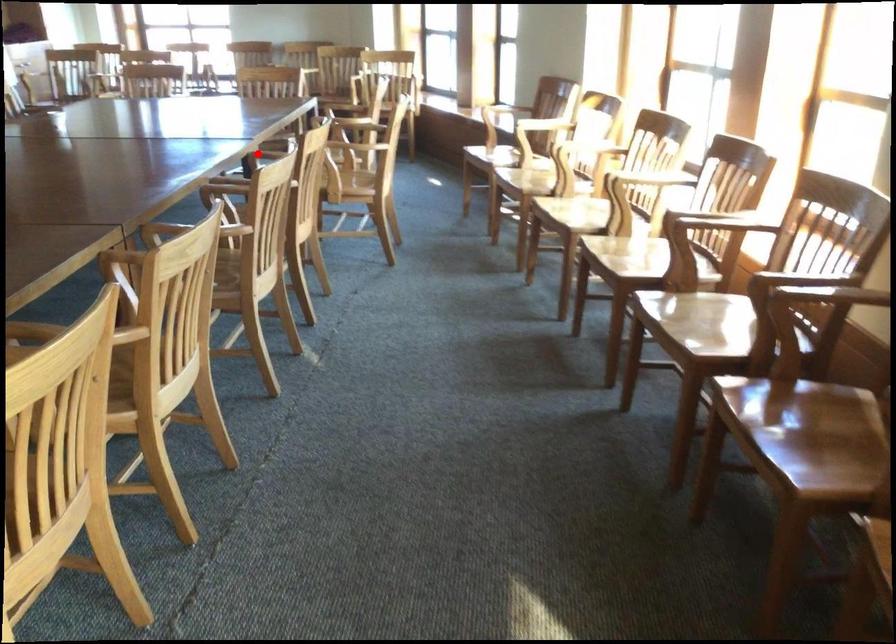
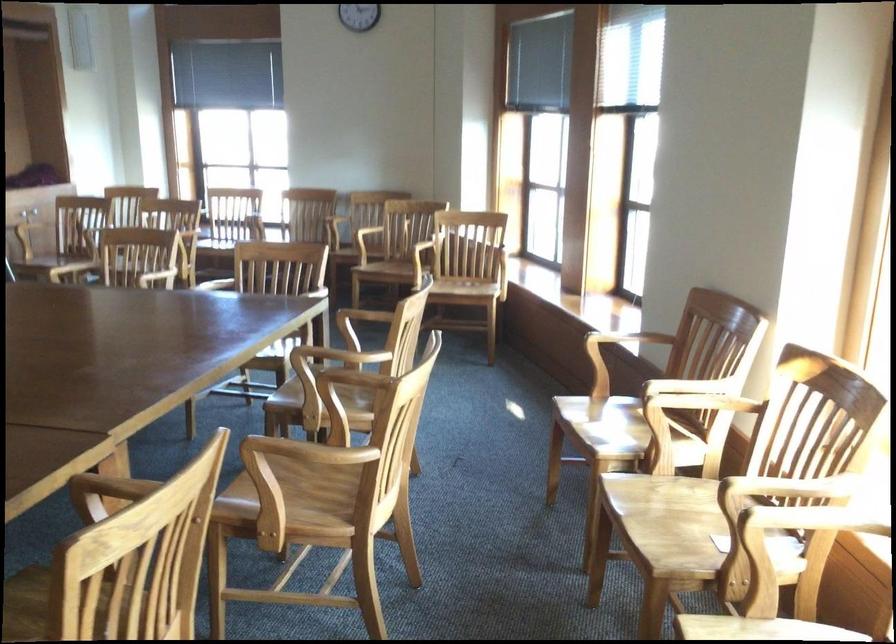
In the second image, find the point that corresponds to the highlighted location in the first image.

(108, 489)